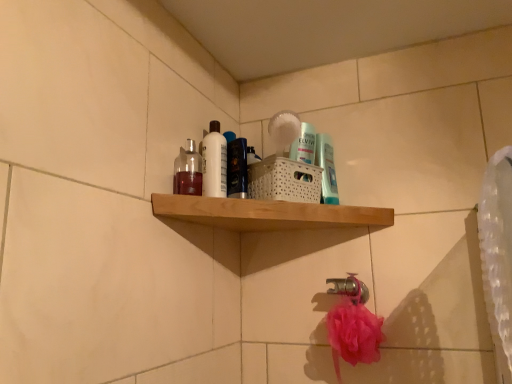
This screenshot has width=512, height=384. What are the coordinates of `white glossy bottle at upper center` in the screenshot? It's located at (214, 162).

Locate an element on the screen. This screenshot has height=384, width=512. silver metallic faucet at lower center is located at coordinates (349, 288).

The height and width of the screenshot is (384, 512). What do you see at coordinates (327, 169) in the screenshot? I see `translucent plastic mouthwash at upper center, arranged as the second mouthwash when viewed from the front` at bounding box center [327, 169].

The image size is (512, 384). Identify the location of white glossy bottle at upper center. (214, 162).

Considering the positions of objects silver metallic faucet at lower center and wooden shelf at upper center in the image provided, who is in front, silver metallic faucet at lower center or wooden shelf at upper center?

wooden shelf at upper center is in front.

How distant is silver metallic faucet at lower center from wooden shelf at upper center?

silver metallic faucet at lower center and wooden shelf at upper center are 10.30 inches apart from each other.

Does silver metallic faucet at lower center touch wooden shelf at upper center?

No, silver metallic faucet at lower center is not touching wooden shelf at upper center.

Image resolution: width=512 pixels, height=384 pixels. In order to click on shelf that is above the silver metallic faucet at lower center (from the image's perspective) in this screenshot , I will do `click(266, 213)`.

Is white glossy bottle at upper center to the right of shiny blue bottle at center from the viewer's perspective?

In fact, white glossy bottle at upper center is to the left of shiny blue bottle at center.

From the image's perspective, would you say white glossy bottle at upper center is positioned over shiny blue bottle at center?

Correct, white glossy bottle at upper center appears higher than shiny blue bottle at center in the image.

Consider the image. Who is taller, white glossy bottle at upper center or shiny blue bottle at center?

With more height is white glossy bottle at upper center.

Are white glossy bottle at upper center and shiny blue bottle at center far apart?

That's not correct — white glossy bottle at upper center is a little close to shiny blue bottle at center.

Looking at this image, between translucent plastic mouthwash at upper center, the first mouthwash viewed from the right, and white glossy bottle at upper center, which one appears on the left side from the viewer's perspective?

From the viewer's perspective, white glossy bottle at upper center appears more on the left side.

Measure the distance between translucent plastic mouthwash at upper center, the second mouthwash when ordered from left to right, and white glossy bottle at upper center.

28.18 centimeters.

From the picture: From the image's perspective, is translucent plastic mouthwash at upper center, arranged as the second mouthwash when viewed from the front, on white glossy bottle at upper center?

Incorrect, from the image's perspective, translucent plastic mouthwash at upper center, arranged as the second mouthwash when viewed from the front, is lower than white glossy bottle at upper center.

Is translucent plastic mouthwash at upper center, which is the first mouthwash from back to front, far away from white glossy bottle at upper center?

No, translucent plastic mouthwash at upper center, which is the first mouthwash from back to front, is not far away from white glossy bottle at upper center.

How much distance is there between silver metallic faucet at lower center and shiny blue bottle at center?

38.07 centimeters.

Would you say silver metallic faucet at lower center contains shiny blue bottle at center?

No, shiny blue bottle at center is not a part of silver metallic faucet at lower center.

From the picture: Based on their positions, is silver metallic faucet at lower center located to the left or right of shiny blue bottle at center?

silver metallic faucet at lower center is to the right of shiny blue bottle at center.

How different are the orientations of silver metallic faucet at lower center and shiny blue bottle at center in degrees?

silver metallic faucet at lower center and shiny blue bottle at center are facing 48.3 degrees away from each other.

Looking at this image, which object is thinner, translucent glass bottle at upper left, which is the first mouthwash in front-to-back order, or shiny blue bottle at center?

translucent glass bottle at upper left, which is the first mouthwash in front-to-back order.

Can you confirm if translucent glass bottle at upper left, which is the first mouthwash in front-to-back order, is positioned to the left of shiny blue bottle at center?

Yes, translucent glass bottle at upper left, which is the first mouthwash in front-to-back order, is to the left of shiny blue bottle at center.

The width and height of the screenshot is (512, 384). Find the location of `mouthwash located on the left of shiny blue bottle at center`. mouthwash located on the left of shiny blue bottle at center is located at coordinates (188, 171).

From the image's perspective, which one is positioned lower, translucent glass bottle at upper left, the second mouthwash in the right-to-left sequence, or shiny blue bottle at center?

translucent glass bottle at upper left, the second mouthwash in the right-to-left sequence.

Is shiny blue bottle at center completely or partially outside of white glossy bottle at upper center?

Absolutely, shiny blue bottle at center is external to white glossy bottle at upper center.

Does shiny blue bottle at center have a lesser height compared to white glossy bottle at upper center?

Yes.

Is point (239, 159) in front of point (213, 132)?

Yes, it is.

Based on the photo, considering the relative sizes of shiny blue bottle at center and white glossy bottle at upper center in the image provided, is shiny blue bottle at center smaller than white glossy bottle at upper center?

Actually, shiny blue bottle at center might be larger than white glossy bottle at upper center.

Does point (192, 199) lie behind point (348, 289)?

No, it is not.

Is wooden shelf at upper center not within silver metallic faucet at lower center?

Absolutely, wooden shelf at upper center is external to silver metallic faucet at lower center.

I want to click on shelf above the silver metallic faucet at lower center (from the image's perspective), so click(266, 213).

From a real-world perspective, is wooden shelf at upper center beneath silver metallic faucet at lower center?

Incorrect, from a real-world perspective, wooden shelf at upper center is higher than silver metallic faucet at lower center.

Locate an element on the screen. shelf located above the silver metallic faucet at lower center (from a real-world perspective) is located at coordinates (266, 213).

This screenshot has width=512, height=384. I want to click on cleaning product lying behind the shiny blue bottle at center, so click(214, 162).

Considering their positions, is silver metallic faucet at lower center positioned further to translucent glass bottle at upper left, which is the first mouthwash in front-to-back order, than translucent plastic mouthwash at upper center, the second mouthwash when ordered from left to right?

silver metallic faucet at lower center is further to translucent glass bottle at upper left, which is the first mouthwash in front-to-back order.

Based on their spatial positions, is wooden shelf at upper center or silver metallic faucet at lower center closer to translucent plastic mouthwash at upper center, the second mouthwash when ordered from left to right?

wooden shelf at upper center is positioned closer to the anchor translucent plastic mouthwash at upper center, the second mouthwash when ordered from left to right.

From the picture: Based on their spatial positions, is white glossy bottle at upper center or translucent glass bottle at upper left, which is the first mouthwash in front-to-back order, closer to wooden shelf at upper center?

The object closer to wooden shelf at upper center is white glossy bottle at upper center.

Which object lies nearer to the anchor point shiny blue bottle at center, translucent glass bottle at upper left, the 1th mouthwash positioned from the left, or silver metallic faucet at lower center?

translucent glass bottle at upper left, the 1th mouthwash positioned from the left.

Looking at the image, which one is located further to wooden shelf at upper center, silver metallic faucet at lower center or translucent plastic mouthwash at upper center, which is the first mouthwash from back to front?

Based on the image, silver metallic faucet at lower center appears to be further to wooden shelf at upper center.

Consider the image. From the image, which object appears to be nearer to white glossy bottle at upper center, shiny blue bottle at center or translucent plastic mouthwash at upper center, which is the first mouthwash from back to front?

shiny blue bottle at center is positioned closer to the anchor white glossy bottle at upper center.

Looking at the image, which one is located further to white glossy bottle at upper center, silver metallic faucet at lower center or translucent glass bottle at upper left, the 1th mouthwash positioned from the left?

The object further to white glossy bottle at upper center is silver metallic faucet at lower center.

Looking at the image, which one is located closer to translucent glass bottle at upper left, the second mouthwash in the right-to-left sequence, translucent plastic mouthwash at upper center, the second mouthwash when ordered from left to right, or white glossy bottle at upper center?

white glossy bottle at upper center is positioned closer to the anchor translucent glass bottle at upper left, the second mouthwash in the right-to-left sequence.

Where is `toiletry between translucent glass bottle at upper left, which is the first mouthwash in front-to-back order, and white glossy bottle at upper center from front to back`? The image size is (512, 384). toiletry between translucent glass bottle at upper left, which is the first mouthwash in front-to-back order, and white glossy bottle at upper center from front to back is located at coordinates (237, 168).

Image resolution: width=512 pixels, height=384 pixels. Identify the location of cleaning product between wooden shelf at upper center and translucent plastic mouthwash at upper center, the second mouthwash when ordered from left to right, in the front-back direction. (214, 162).

I want to click on toiletry between translucent glass bottle at upper left, which is the first mouthwash in front-to-back order, and translucent plastic mouthwash at upper center, arranged as the second mouthwash when viewed from the front, from left to right, so click(237, 168).

Find the location of a particular element. mouthwash between wooden shelf at upper center and white glossy bottle at upper center along the z-axis is located at coordinates (188, 171).